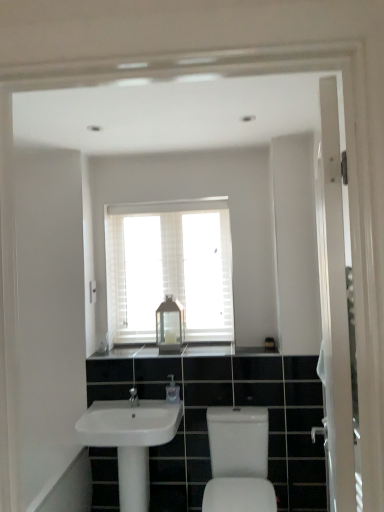
Question: Is white glossy screen door at right thinner than white glossy sink at lower left, acting as the 1th sink starting from the left?

Choices:
 (A) no
 (B) yes

Answer: (B)

Question: Does white glossy screen door at right appear on the left side of white glossy sink at lower left, acting as the 1th sink starting from the left?

Choices:
 (A) no
 (B) yes

Answer: (A)

Question: Considering the relative sizes of white glossy screen door at right and white glossy sink at lower left, acting as the 1th sink starting from the left, in the image provided, is white glossy screen door at right taller than white glossy sink at lower left, acting as the 1th sink starting from the left,?

Choices:
 (A) yes
 (B) no

Answer: (A)

Question: From the image's perspective, is white glossy screen door at right above white glossy sink at lower left, which is counted as the 2th sink, starting from the right?

Choices:
 (A) yes
 (B) no

Answer: (A)

Question: Is the position of white glossy screen door at right more distant than that of white glossy sink at lower left, which is counted as the 2th sink, starting from the right?

Choices:
 (A) yes
 (B) no

Answer: (B)

Question: Is white glossy screen door at right oriented towards white glossy sink at lower left, acting as the 1th sink starting from the left?

Choices:
 (A) no
 (B) yes

Answer: (A)

Question: Is white glossy sink at lower left, acting as the 1th sink starting from the left, to the left of metallic glass lantern at center from the viewer's perspective?

Choices:
 (A) yes
 (B) no

Answer: (A)

Question: Considering the relative positions of white glossy sink at lower left, which is counted as the 2th sink, starting from the right, and metallic glass lantern at center in the image provided, is white glossy sink at lower left, which is counted as the 2th sink, starting from the right, to the right of metallic glass lantern at center from the viewer's perspective?

Choices:
 (A) no
 (B) yes

Answer: (A)

Question: Is white glossy sink at lower left, which is counted as the 2th sink, starting from the right, thinner than metallic glass lantern at center?

Choices:
 (A) yes
 (B) no

Answer: (B)

Question: Would you consider white glossy sink at lower left, which is counted as the 2th sink, starting from the right, to be distant from metallic glass lantern at center?

Choices:
 (A) no
 (B) yes

Answer: (A)

Question: Considering the relative sizes of white glossy sink at lower left, which is counted as the 2th sink, starting from the right, and metallic glass lantern at center in the image provided, is white glossy sink at lower left, which is counted as the 2th sink, starting from the right, shorter than metallic glass lantern at center?

Choices:
 (A) yes
 (B) no

Answer: (A)

Question: Can you confirm if white glossy sink at lower left, acting as the 1th sink starting from the left, is taller than metallic glass lantern at center?

Choices:
 (A) yes
 (B) no

Answer: (B)

Question: Is clear plastic soap dispenser at center closer to camera compared to white glossy sink at lower left, which is counted as the 2th sink, starting from the right?

Choices:
 (A) no
 (B) yes

Answer: (A)